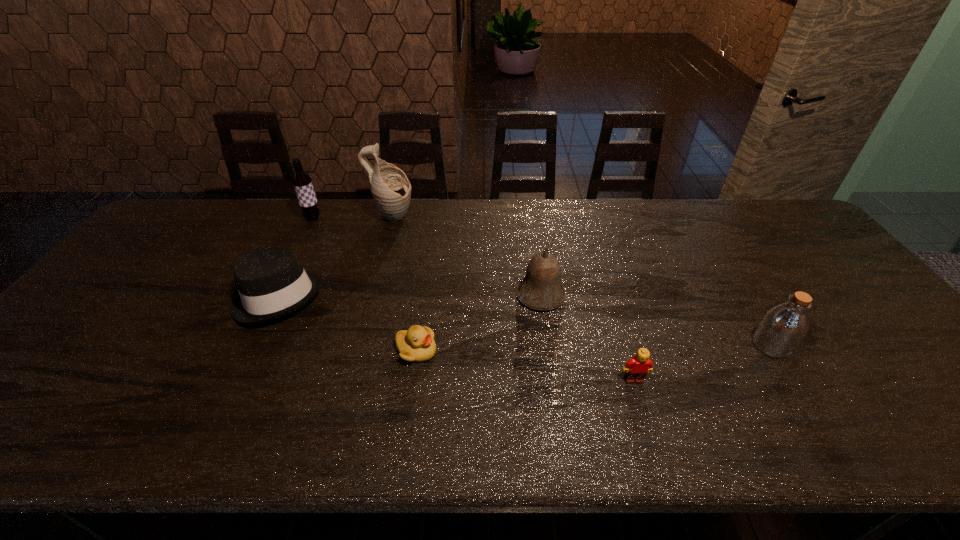
The image size is (960, 540). I want to click on vacant space at the near edge, so click(286, 427).

The image size is (960, 540). What are the coordinates of `blank area at the left edge` in the screenshot? It's located at (12, 409).

Where is `vacant space at the far left corner of the desktop`? vacant space at the far left corner of the desktop is located at coordinates (174, 237).

This screenshot has width=960, height=540. Find the location of `vacant space at the near left corner of the desktop`. vacant space at the near left corner of the desktop is located at coordinates (36, 415).

Where is `free space at the far right corner`? free space at the far right corner is located at coordinates (762, 200).

Identify the location of vacant point located between the fifth tallest object and the duckling. (347, 323).

You are a GUI agent. You are given a task and a screenshot of the screen. Output one action in this format:
    pyautogui.click(x=<x>, y=<y>)
    Task: Click on the vacant space in between the pitcher and the bell
    The height and width of the screenshot is (540, 960).
    Given the screenshot: What is the action you would take?
    pyautogui.click(x=467, y=256)

Locate an element on the screen. vacant area that lies between the shortest object and the sixth tallest object is located at coordinates (525, 365).

Where is `free space between the shortest object and the fifth object from left to right`? Image resolution: width=960 pixels, height=540 pixels. free space between the shortest object and the fifth object from left to right is located at coordinates (478, 323).

Locate an element on the screen. The width and height of the screenshot is (960, 540). empty space that is in between the shortest object and the root beer is located at coordinates (365, 284).